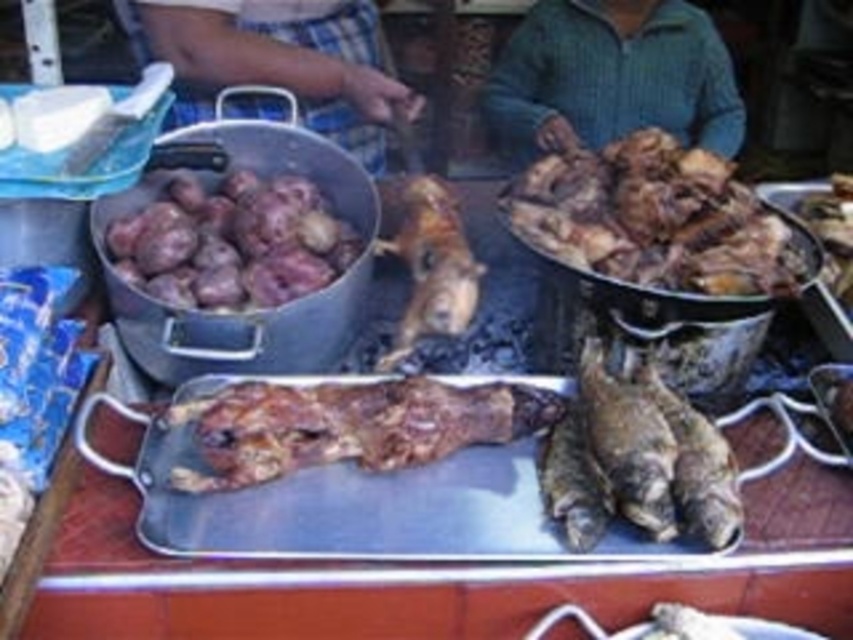
Question: Among these points, which one is farthest from the camera?

Choices:
 (A) (331, 412)
 (B) (792, 268)
 (C) (260, 6)
 (D) (850, 182)

Answer: (C)

Question: Can you confirm if brown crispy chicken at upper right is thinner than shiny silver tray at center?

Choices:
 (A) no
 (B) yes

Answer: (A)

Question: Based on their relative distances, which object is farther from the golden brown crispy meat at center?

Choices:
 (A) plaid fabric at upper left
 (B) purple matte potatoes at upper left
 (C) brown crispy meat at center
 (D) brown crispy chicken at upper right

Answer: (A)

Question: Does brown crispy chicken at upper right have a smaller size compared to plaid fabric at upper left?

Choices:
 (A) yes
 (B) no

Answer: (A)

Question: Which point appears farthest from the camera in this image?

Choices:
 (A) (648, 147)
 (B) (674, 106)
 (C) (230, 257)
 (D) (421, 336)

Answer: (B)

Question: Does plaid fabric at upper left appear over golden brown crispy meat at center?

Choices:
 (A) yes
 (B) no

Answer: (A)